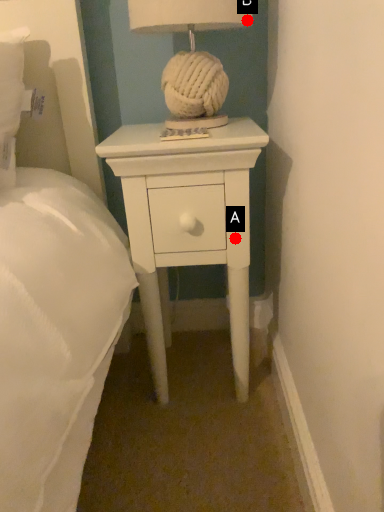
Question: Two points are circled on the image, labeled by A and B beside each circle. Which point appears closest to the camera in this image?

Choices:
 (A) A is closer
 (B) B is closer

Answer: (B)